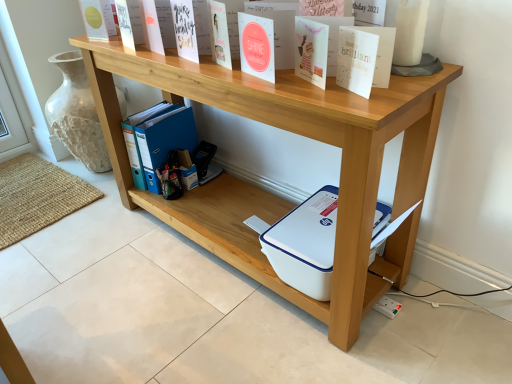
Find the location of `blue plastic ring binder at lower center`. blue plastic ring binder at lower center is located at coordinates (157, 140).

Describe the element at coordinates (94, 20) in the screenshot. I see `matte yellow card at upper left, the 1th paperback book in the top-to-bottom sequence` at that location.

Find the location of `matte yellow card at upper left, positioned as the third paperback book in right-to-left order`. matte yellow card at upper left, positioned as the third paperback book in right-to-left order is located at coordinates (94, 20).

Measure the distance between point (176, 26) and camera.

4.08 feet.

Where is `natural wood shelf at upper center, which appears as the 1th shelf when viewed from the top`? The width and height of the screenshot is (512, 384). natural wood shelf at upper center, which appears as the 1th shelf when viewed from the top is located at coordinates (292, 132).

What do you see at coordinates (292, 132) in the screenshot? I see `natural wood shelf at upper center, placed as the 2th shelf when sorted from bottom to top` at bounding box center [292, 132].

This screenshot has height=384, width=512. Find the location of `blue plastic ring binder at lower center`. blue plastic ring binder at lower center is located at coordinates (157, 140).

From a real-world perspective, which is physically below, matte blue notebook at upper center, marked as the 2th paperback book in a top-to-bottom arrangement, or blue plastic ring binder at lower center?

blue plastic ring binder at lower center.

Is matte blue notebook at upper center, marked as the 2th paperback book in a top-to-bottom arrangement, bigger or smaller than blue plastic ring binder at lower center?

Clearly, matte blue notebook at upper center, marked as the 2th paperback book in a top-to-bottom arrangement, is smaller in size than blue plastic ring binder at lower center.

Consider the image. Is matte blue notebook at upper center, marked as the 2th paperback book in a top-to-bottom arrangement, not within blue plastic ring binder at lower center?

Yes, matte blue notebook at upper center, marked as the 2th paperback book in a top-to-bottom arrangement, is located beyond the bounds of blue plastic ring binder at lower center.

Is point (181, 43) closer or farther from the camera than point (184, 121)?

Point (181, 43) is closer to the camera than point (184, 121).

Does matte blue notebook at upper center, positioned as the second paperback book in front-to-back order, come in front of white paper at upper right, the 1th paperback book from the bottom?

No, matte blue notebook at upper center, positioned as the second paperback book in front-to-back order, is behind white paper at upper right, the 1th paperback book from the bottom.

From the image's perspective, who appears lower, matte blue notebook at upper center, placed as the 2th paperback book when sorted from left to right, or white paper at upper right, the 1th paperback book from the bottom?

From the image's view, white paper at upper right, the 1th paperback book from the bottom, is below.

Which of these two, matte blue notebook at upper center, marked as the 2th paperback book in a top-to-bottom arrangement, or white paper at upper right, the 1th paperback book from the right, is smaller?

white paper at upper right, the 1th paperback book from the right, is smaller.

Would you say blue plastic ring binder at lower center is to the left or to the right of natural wood shelf at upper center, placed as the 2th shelf when sorted from bottom to top, in the picture?

Based on their positions, blue plastic ring binder at lower center is located to the left of natural wood shelf at upper center, placed as the 2th shelf when sorted from bottom to top.

Does blue plastic ring binder at lower center have a greater width compared to natural wood shelf at upper center, placed as the 2th shelf when sorted from bottom to top?

No, blue plastic ring binder at lower center is not wider than natural wood shelf at upper center, placed as the 2th shelf when sorted from bottom to top.

Does point (138, 141) come farther from viewer compared to point (255, 235)?

Yes, point (138, 141) is behind point (255, 235).

From the image's perspective, which one is positioned higher, blue plastic ring binder at lower center or natural wood shelf at upper center, which appears as the 1th shelf when viewed from the top?

blue plastic ring binder at lower center appears higher in the image.

Which object is further away from the camera, white paper at upper right, the 1th paperback book from the bottom, or blue plastic ring binder at lower center?

blue plastic ring binder at lower center is further from the camera.

From the image's perspective, count 1st paperback books upward from the blue plastic ring binder at lower center and point to it. Please provide its 2D coordinates.

[(356, 60)]

Can you tell me how much white paper at upper right, the 3th paperback book in the back-to-front sequence, and blue plastic ring binder at lower center differ in facing direction?

The angular difference between white paper at upper right, the 3th paperback book in the back-to-front sequence, and blue plastic ring binder at lower center is 24.5 degrees.

Would you consider white paper at upper right, arranged as the third paperback book when viewed from the left, to be distant from blue plastic ring binder at lower center?

Yes, white paper at upper right, arranged as the third paperback book when viewed from the left, is far from blue plastic ring binder at lower center.

Which of these two, white plastic printer at lower center, which appears as the 1th shelf when ordered from the bottom, or matte blue notebook at upper center, placed as the 2th paperback book when sorted from bottom to top, is smaller?

With smaller size is matte blue notebook at upper center, placed as the 2th paperback book when sorted from bottom to top.

From a real-world perspective, between white plastic printer at lower center, which appears as the 1th shelf when ordered from the bottom, and matte blue notebook at upper center, positioned as the second paperback book in front-to-back order, who is vertically lower?

white plastic printer at lower center, which appears as the 1th shelf when ordered from the bottom.

Considering the points (371, 276) and (186, 27), which point is behind, point (371, 276) or point (186, 27)?

Point (371, 276)

In the scene shown: Is white plastic printer at lower center, positioned as the 2th shelf in top-to-bottom order, shorter than matte blue notebook at upper center, which is counted as the 2th paperback book, starting from the right?

Incorrect, the height of white plastic printer at lower center, positioned as the 2th shelf in top-to-bottom order, does not fall short of that of matte blue notebook at upper center, which is counted as the 2th paperback book, starting from the right.

At what (x,y) coordinates should I click in order to perform the action: click on the 2nd shelf counting from the left side of the white paper at upper right, arranged as the third paperback book when viewed from the left. Please return your answer as a coordinate pair (x, y). The image size is (512, 384). Looking at the image, I should click on (292, 132).

From a real-world perspective, is white paper at upper right, arranged as the third paperback book when viewed from the left, located higher than natural wood shelf at upper center, placed as the 2th shelf when sorted from bottom to top?

Yes.

Is point (346, 80) less distant than point (310, 108)?

That is False.

Which object is thinner, natural wood shelf at upper center, placed as the 2th shelf when sorted from bottom to top, or white paper at upper right, the 3th paperback book in the back-to-front sequence?

With smaller width is white paper at upper right, the 3th paperback book in the back-to-front sequence.

Between natural wood shelf at upper center, which appears as the 1th shelf when viewed from the top, and white paper at upper right, the 3th paperback book in the back-to-front sequence, which one has smaller size?

With smaller size is white paper at upper right, the 3th paperback book in the back-to-front sequence.

Considering the relative sizes of natural wood shelf at upper center, which appears as the 1th shelf when viewed from the top, and white paper at upper right, the 3th paperback book in the back-to-front sequence, in the image provided, is natural wood shelf at upper center, which appears as the 1th shelf when viewed from the top, taller than white paper at upper right, the 3th paperback book in the back-to-front sequence,?

Yes, natural wood shelf at upper center, which appears as the 1th shelf when viewed from the top, is taller than white paper at upper right, the 3th paperback book in the back-to-front sequence.

Is natural wood shelf at upper center, which appears as the 1th shelf when viewed from the top, inside the boundaries of white paper at upper right, which is the 1th paperback book in front-to-back order, or outside?

natural wood shelf at upper center, which appears as the 1th shelf when viewed from the top, exists outside the volume of white paper at upper right, which is the 1th paperback book in front-to-back order.

This screenshot has height=384, width=512. Identify the location of book below the matte blue notebook at upper center, placed as the 2th paperback book when sorted from bottom to top (from the image's perspective). (157, 140).

From a real-world perspective, starting from the white paper at upper right, which appears as the third paperback book when viewed from the top, which paperback book is the 2nd one vertically above it? Please provide its 2D coordinates.

[(185, 29)]

From the image, which object appears to be farther from blue plastic ring binder at lower center, matte yellow card at upper left, marked as the 1th paperback book in a back-to-front arrangement, or matte blue notebook at upper center, marked as the 2th paperback book in a top-to-bottom arrangement?

matte blue notebook at upper center, marked as the 2th paperback book in a top-to-bottom arrangement, is further to blue plastic ring binder at lower center.

From the image, which object appears to be nearer to white plastic printer at lower center, which appears as the 1th shelf when ordered from the bottom, white paper at upper right, which appears as the third paperback book when viewed from the top, or natural wood shelf at upper center, placed as the 2th shelf when sorted from bottom to top?

natural wood shelf at upper center, placed as the 2th shelf when sorted from bottom to top, lies closer to white plastic printer at lower center, which appears as the 1th shelf when ordered from the bottom, than the other object.

Based on their spatial positions, is matte yellow card at upper left, which is counted as the third paperback book, starting from the bottom, or white plastic printer at lower center, positioned as the 2th shelf in top-to-bottom order, further from matte blue notebook at upper center, marked as the 2th paperback book in a back-to-front arrangement?

white plastic printer at lower center, positioned as the 2th shelf in top-to-bottom order, is positioned further to the anchor matte blue notebook at upper center, marked as the 2th paperback book in a back-to-front arrangement.

Estimate the real-world distances between objects in this image. Which object is closer to white plastic printer at lower center, positioned as the 2th shelf in top-to-bottom order, natural wood shelf at upper center, placed as the 2th shelf when sorted from bottom to top, or blue plastic ring binder at lower center?

natural wood shelf at upper center, placed as the 2th shelf when sorted from bottom to top.

Looking at the image, which one is located closer to matte yellow card at upper left, which is counted as the third paperback book, starting from the front, natural wood shelf at upper center, which appears as the 1th shelf when viewed from the top, or white plastic printer at lower center, positioned as the 2th shelf in top-to-bottom order?

natural wood shelf at upper center, which appears as the 1th shelf when viewed from the top.

Considering their positions, is natural wood shelf at upper center, placed as the 2th shelf when sorted from bottom to top, positioned closer to blue plastic ring binder at lower center than white plastic printer at lower center, positioned as the 2th shelf in top-to-bottom order?

Among the two, white plastic printer at lower center, positioned as the 2th shelf in top-to-bottom order, is located nearer to blue plastic ring binder at lower center.

From the image, which object appears to be farther from blue plastic ring binder at lower center, natural wood shelf at upper center, which appears as the 1th shelf when viewed from the top, or matte blue notebook at upper center, marked as the 2th paperback book in a top-to-bottom arrangement?

matte blue notebook at upper center, marked as the 2th paperback book in a top-to-bottom arrangement, lies further to blue plastic ring binder at lower center than the other object.

When comparing their distances from white plastic printer at lower center, positioned as the 2th shelf in top-to-bottom order, does blue plastic ring binder at lower center or natural wood shelf at upper center, which appears as the 1th shelf when viewed from the top, seem further?

blue plastic ring binder at lower center.

Where is `paperback book between matte yellow card at upper left, marked as the 1th paperback book in a back-to-front arrangement, and white paper at upper right, which is the 1th paperback book in front-to-back order, in the horizontal direction`? paperback book between matte yellow card at upper left, marked as the 1th paperback book in a back-to-front arrangement, and white paper at upper right, which is the 1th paperback book in front-to-back order, in the horizontal direction is located at coordinates point(185,29).

Identify the location of shelf situated between matte yellow card at upper left, which is counted as the third paperback book, starting from the front, and white plastic printer at lower center, which appears as the 1th shelf when ordered from the bottom, from left to right. The image size is (512, 384). (292, 132).

Locate an element on the screen. shelf between matte blue notebook at upper center, positioned as the second paperback book in front-to-back order, and white plastic printer at lower center, which appears as the 1th shelf when ordered from the bottom, in the up-down direction is located at coordinates (292, 132).

Where is `paperback book between matte blue notebook at upper center, marked as the 2th paperback book in a back-to-front arrangement, and white plastic printer at lower center, positioned as the 2th shelf in top-to-bottom order, from top to bottom`? The height and width of the screenshot is (384, 512). paperback book between matte blue notebook at upper center, marked as the 2th paperback book in a back-to-front arrangement, and white plastic printer at lower center, positioned as the 2th shelf in top-to-bottom order, from top to bottom is located at coordinates (356, 60).